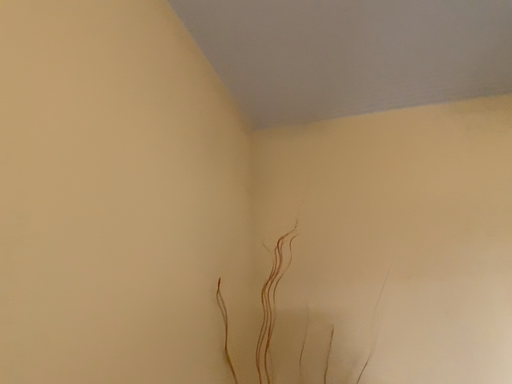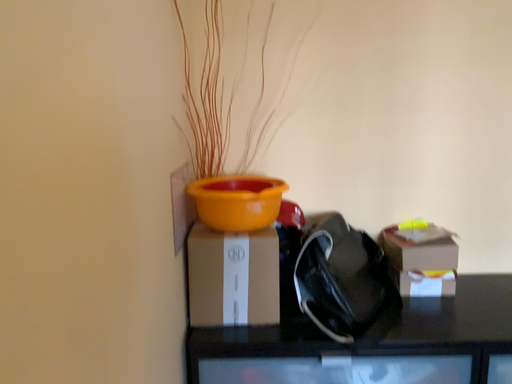
Question: Which way did the camera rotate in the video?

Choices:
 (A) rotated downward
 (B) rotated upward

Answer: (A)